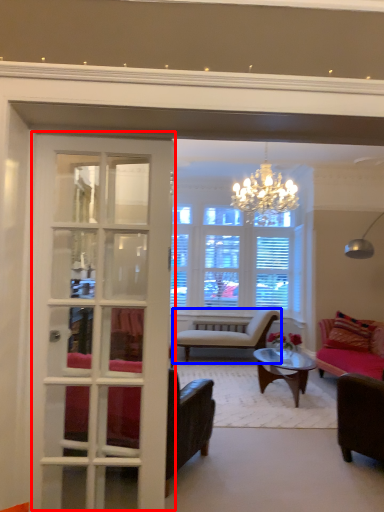
Question: Which point is further to the camera, door (highlighted by a red box) or chair (highlighted by a blue box)?

Choices:
 (A) door
 (B) chair

Answer: (B)